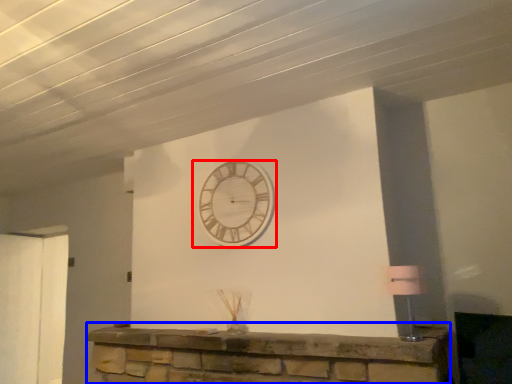
Question: Which object appears farthest to the camera in this image, wall clock (highlighted by a red box) or furniture (highlighted by a blue box)?

Choices:
 (A) wall clock
 (B) furniture

Answer: (A)